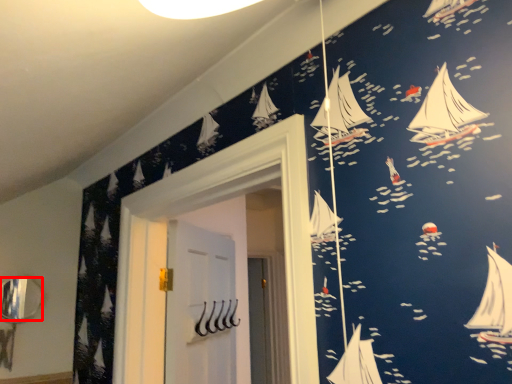
Question: Considering the relative positions of mirror (annotated by the red box) and door in the image provided, where is mirror (annotated by the red box) located with respect to the staircase?

Choices:
 (A) right
 (B) left

Answer: (B)